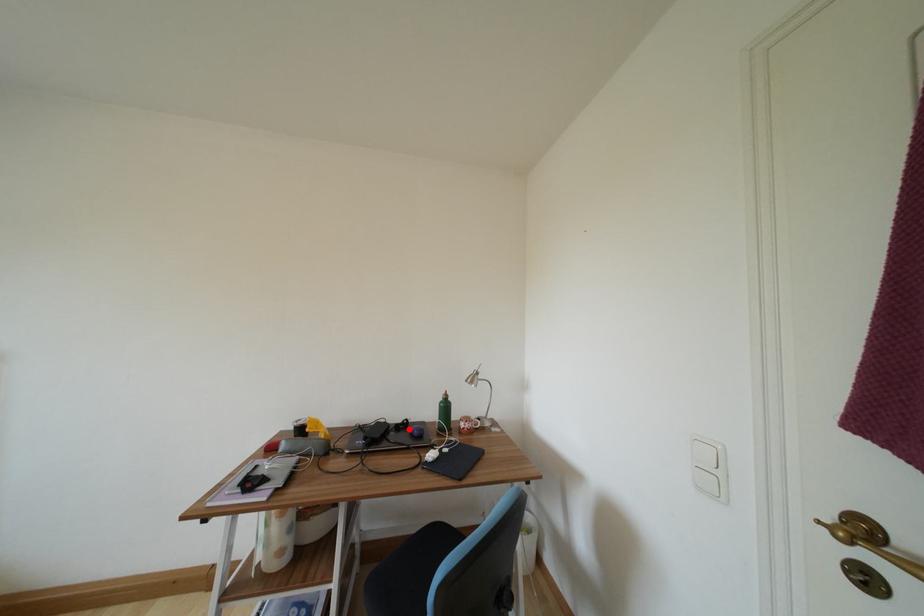
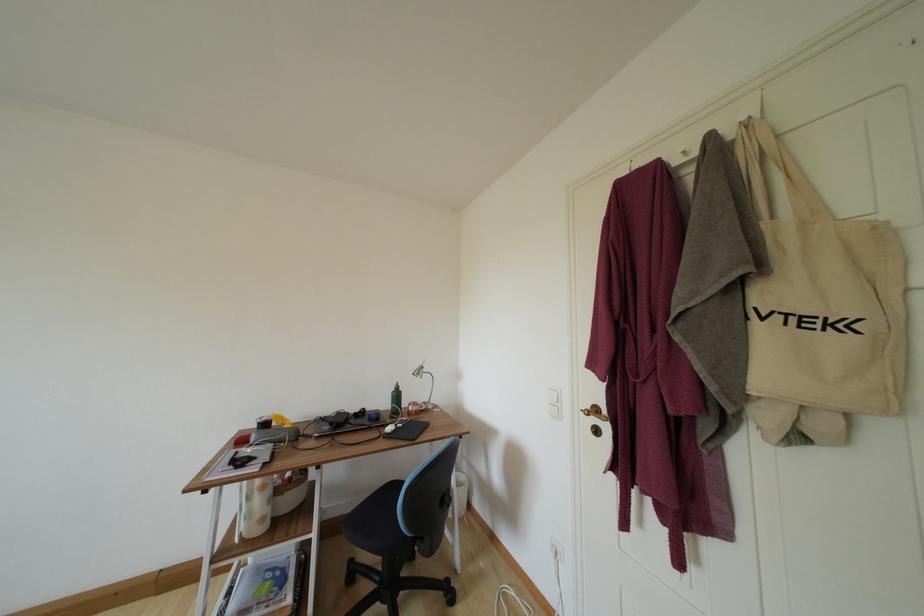
Question: I am providing you with two images of the same scene from different viewpoints. Given a red point in image1, look at the same physical point in image2. Is it:

Choices:
 (A) Closer to the viewpoint
 (B) Farther from the viewpoint

Answer: (B)